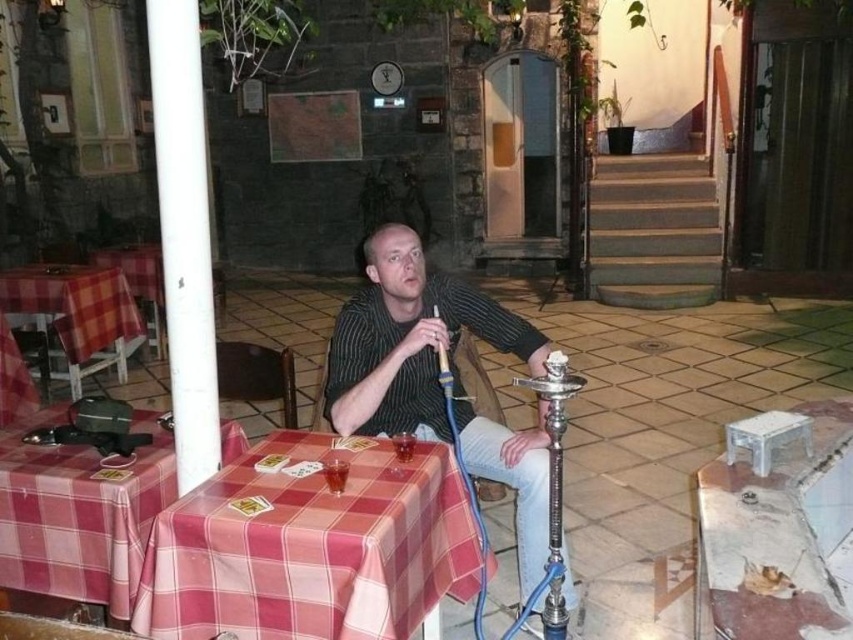
Can you confirm if plaid fabric table at center is positioned above striped fabric shirt at center?

No, plaid fabric table at center is not above striped fabric shirt at center.

Which is more to the right, plaid fabric table at center or striped fabric shirt at center?

striped fabric shirt at center

Is point (370, 472) behind point (457, 404)?

No, (370, 472) is in front of (457, 404).

Where is `plaid fabric table at center`? plaid fabric table at center is located at coordinates (310, 548).

Does plaid fabric table at center appear under checkered fabric table at left?

Yes.

I want to click on plaid fabric table at center, so click(x=310, y=548).

Can you confirm if plaid fabric table at center is shorter than plaid fabric table at lower left?

Incorrect, plaid fabric table at center's height does not fall short of plaid fabric table at lower left's.

Does point (254, 620) come behind point (82, 570)?

No, (254, 620) is closer to viewer.

Identify the location of plaid fabric table at center. (310, 548).